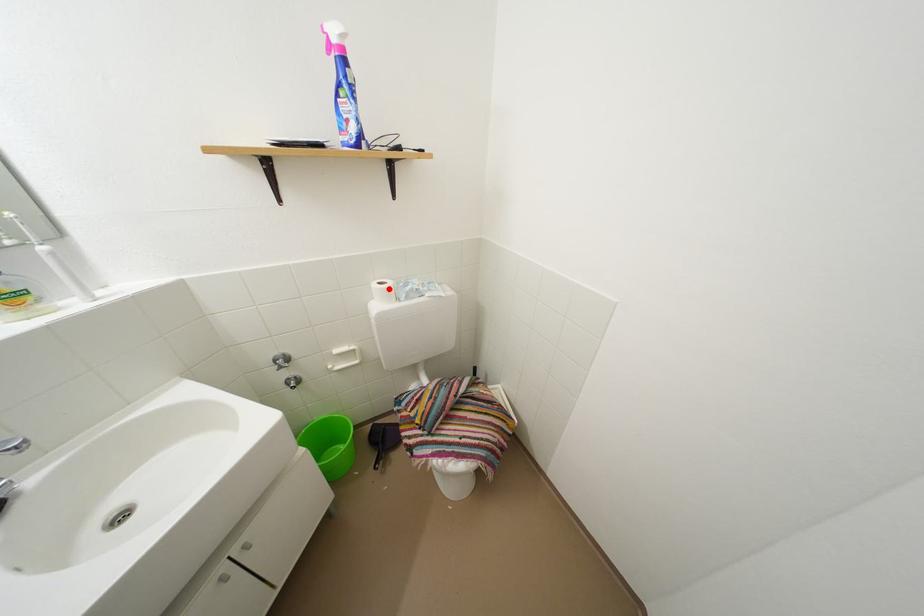
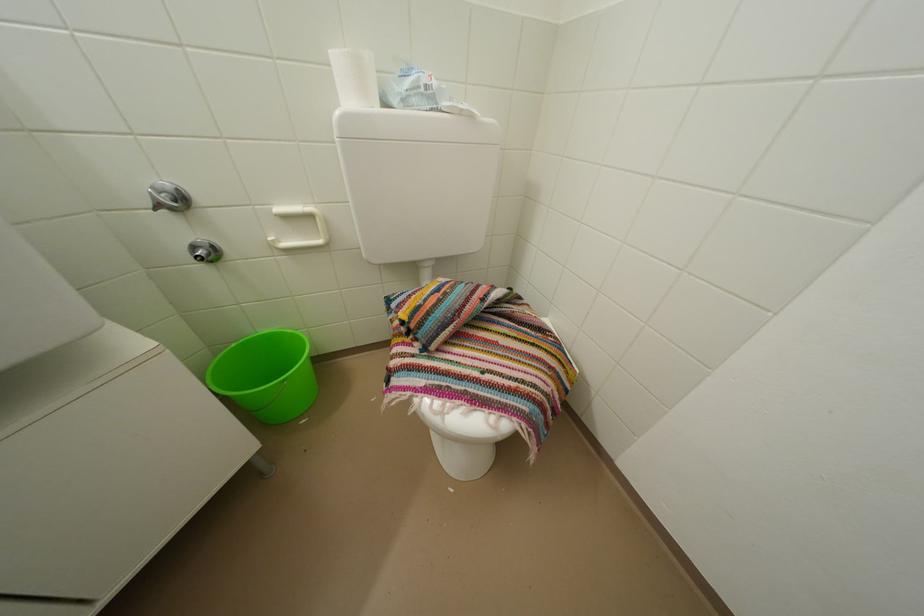
The point at the highlighted location is marked in the first image. Where is the corresponding point in the second image?

(359, 55)